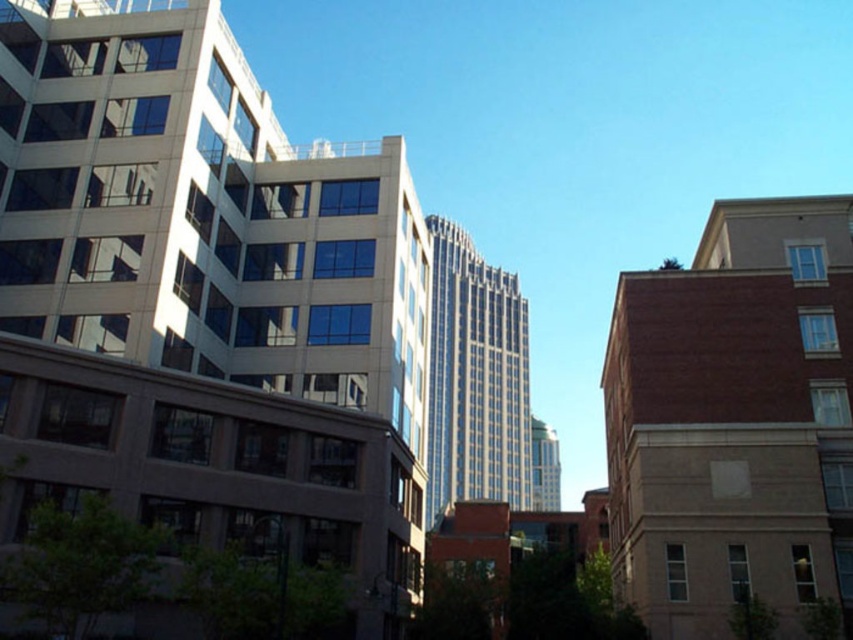
You are an urban planner analyzing the layout of this city block. The point marked at coordinates (x=212, y=288) corresponds to a specific building. Based on the scene description, what type of building is located at this point?

The point at coordinates (x=212, y=288) indicates a matte glass building at center, which is the tall skyscraper with a sleek design and reflective glass windows described in the scene.

You are an architect analyzing the urban layout. You need to determine which building is wider between the matte glass building at center and the glassy silver skyscraper at center. Which one is wider?

The glassy silver skyscraper at center is wider than the matte glass building at center because the matte glass building at center has a smaller width according to the description.